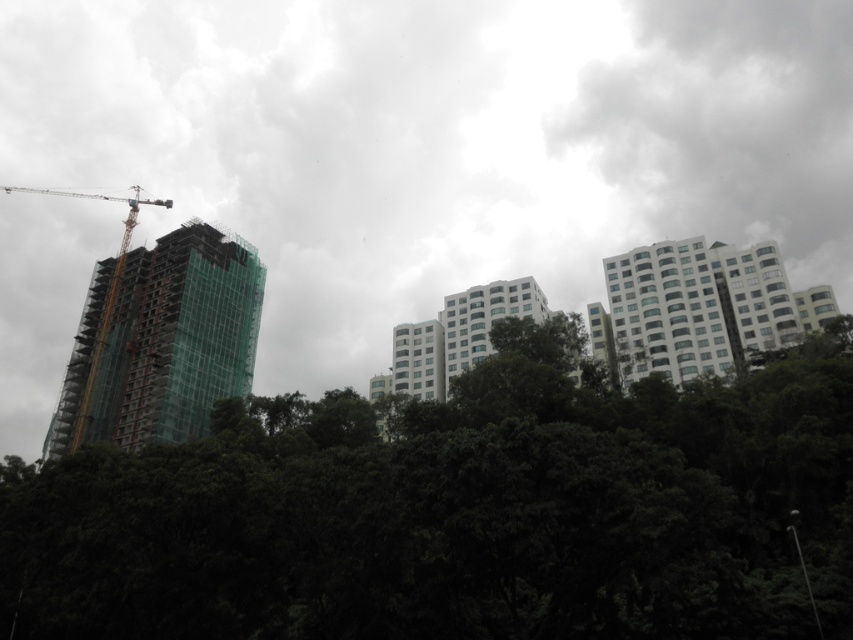
Consider the image. Which is more to the left, transparent glass building at upper left or green leafy trees at center?

transparent glass building at upper left

What are the coordinates of `transparent glass building at upper left` in the screenshot? It's located at 439,144.

Is the position of green glass building at left more distant than that of white glossy building at upper right?

Yes, it is.

Does green glass building at left have a lesser height compared to white glossy building at upper right?

A: Incorrect, green glass building at left's height does not fall short of white glossy building at upper right's.

Is point (253, 333) positioned before point (776, 272)?

That is False.

The height and width of the screenshot is (640, 853). In order to click on green glass building at left in this screenshot , I will do `click(177, 337)`.

Is white glossy building at upper right smaller than yellow metal crane at left?

Yes, white glossy building at upper right is smaller than yellow metal crane at left.

This screenshot has width=853, height=640. What do you see at coordinates (695, 307) in the screenshot? I see `white glossy building at upper right` at bounding box center [695, 307].

Is point (635, 340) more distant than point (105, 300)?

No, it is in front of (105, 300).

Where is `white glossy building at upper right`? This screenshot has width=853, height=640. white glossy building at upper right is located at coordinates (695, 307).